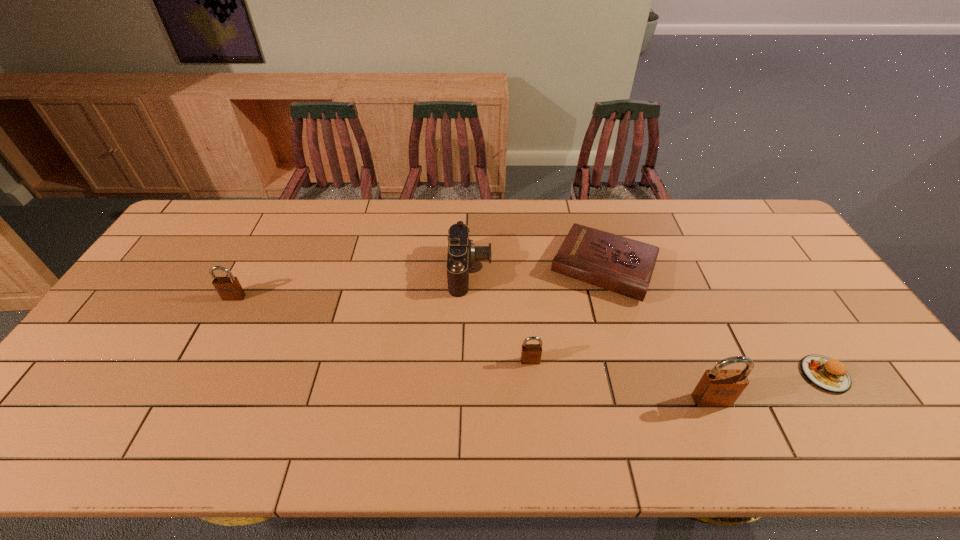
This screenshot has width=960, height=540. I want to click on vacant space that satisfies the following two spatial constraints: 1. on the front-facing side of the rightmost object; 2. on the left side of the second nearest padlock, so click(x=532, y=374).

Locate an element on the screen. blank space that satisfies the following two spatial constraints: 1. on the front-facing side of the second shortest padlock; 2. on the left side of the patty is located at coordinates (193, 374).

The image size is (960, 540). In order to click on free space in the image that satisfies the following two spatial constraints: 1. on the front-facing side of the camera; 2. on the front-facing side of the second shortest padlock in this screenshot , I will do `click(469, 297)`.

The image size is (960, 540). I want to click on free point that satisfies the following two spatial constraints: 1. on the front-facing side of the fifth object from right to left; 2. on the front-facing side of the farthest padlock, so click(x=469, y=297).

Locate an element on the screen. The height and width of the screenshot is (540, 960). vacant point that satisfies the following two spatial constraints: 1. on the front-facing side of the shortest object; 2. on the right side of the second nearest padlock is located at coordinates (532, 374).

This screenshot has height=540, width=960. What are the coordinates of `vacant area in the image that satisfies the following two spatial constraints: 1. on the front-facing side of the third object from left to right; 2. on the right side of the rightmost object` in the screenshot? It's located at (532, 374).

Find the location of `free point that satisfies the following two spatial constraints: 1. on the front-facing side of the camera; 2. on the left side of the patty`. free point that satisfies the following two spatial constraints: 1. on the front-facing side of the camera; 2. on the left side of the patty is located at coordinates (468, 374).